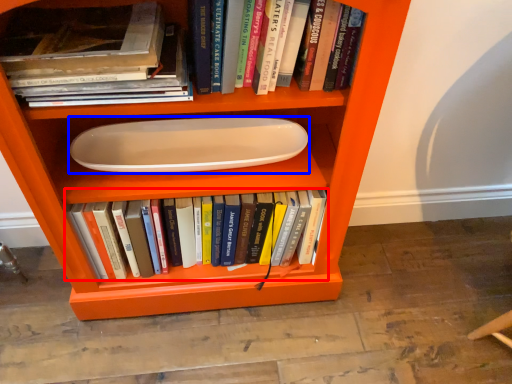
Question: Which point is closer to the camera, book (highlighted by a red box) or paper plate (highlighted by a blue box)?

Choices:
 (A) book
 (B) paper plate

Answer: (B)